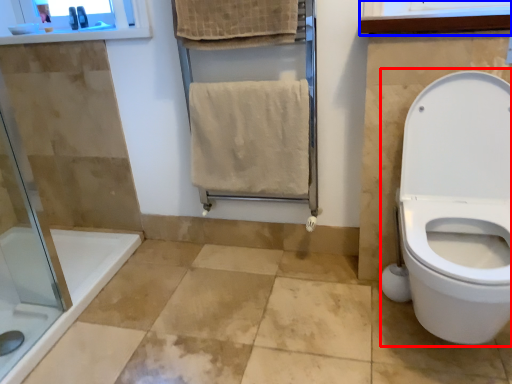
Question: Among these objects, which one is nearest to the camera, sit (highlighted by a red box) or medicine cabinet (highlighted by a blue box)?

Choices:
 (A) sit
 (B) medicine cabinet

Answer: (A)